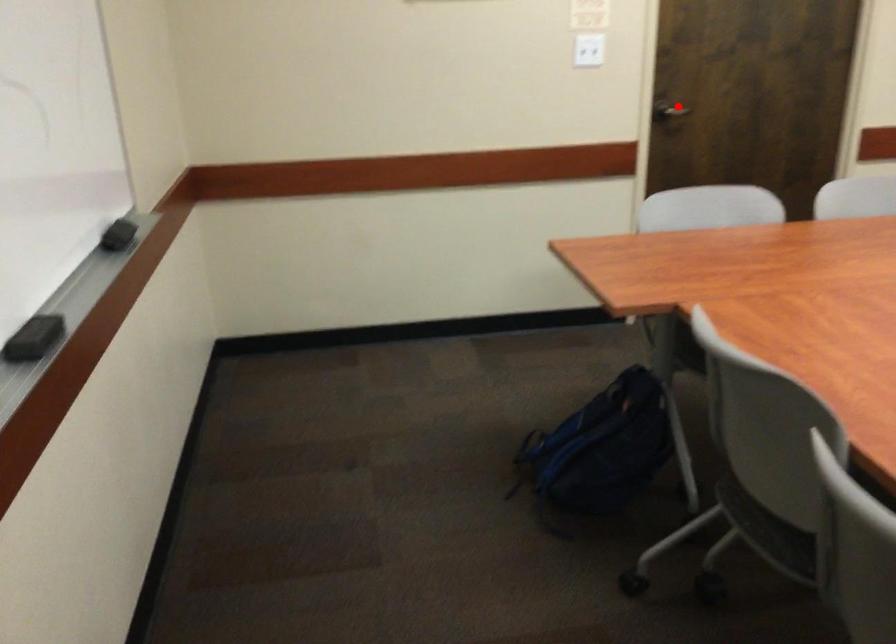
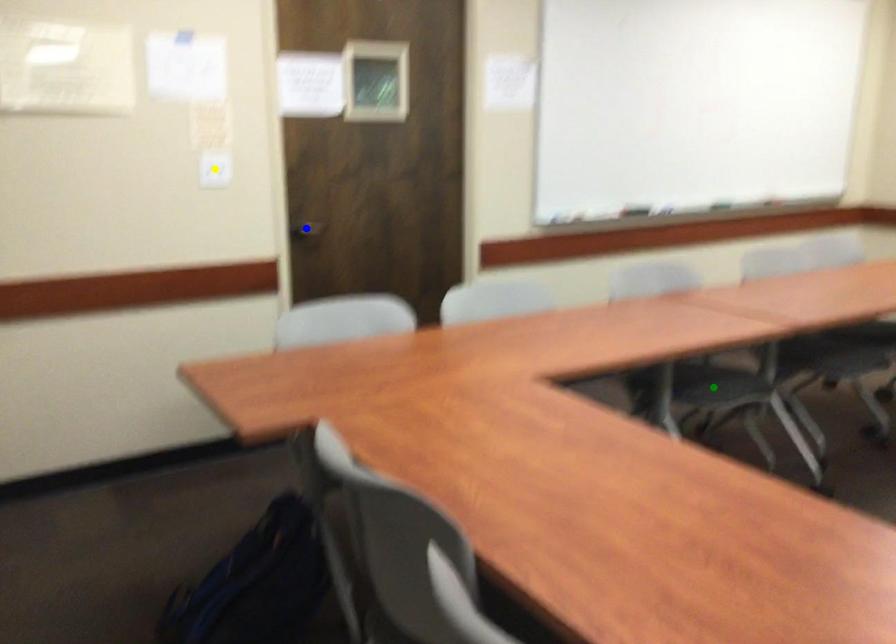
Question: I am providing you with two images of the same scene from different viewpoints. A red point is marked on the first image. You are given multiple points on the second image. Which spot in image 2 lines up with the point in image 1?

Choices:
 (A) yellow point
 (B) green point
 (C) blue point

Answer: (C)